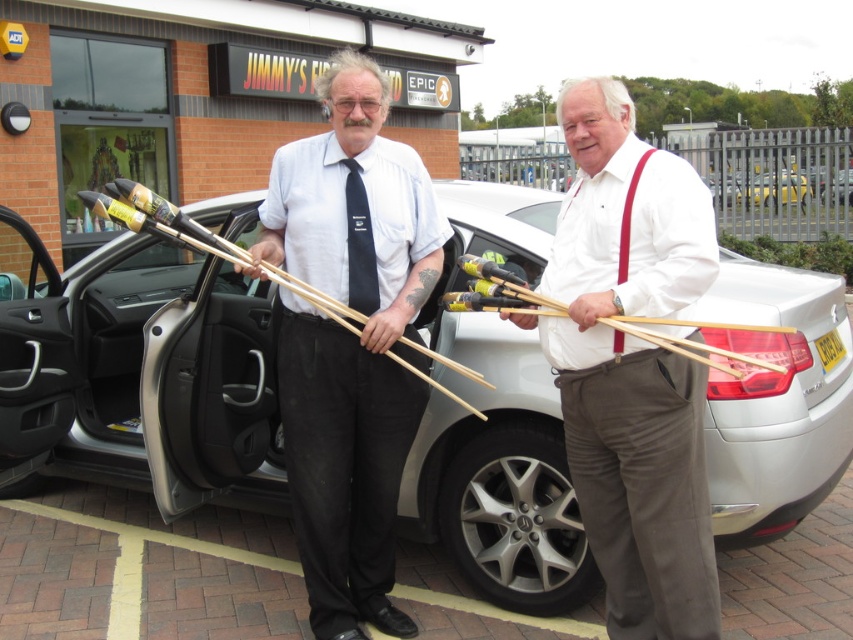
Question: Can you confirm if white matte shirt at center is smaller than white glossy sedan at center?

Choices:
 (A) no
 (B) yes

Answer: (A)

Question: Which object appears farthest from the camera in this image?

Choices:
 (A) white glossy sedan at center
 (B) white matte car at center
 (C) white matte shirt at center
 (D) wooden sticks at center

Answer: (A)

Question: Which object appears closest to the camera in this image?

Choices:
 (A) white matte shirt at center
 (B) wooden sticks at center
 (C) white glossy sedan at center

Answer: (A)

Question: In this image, where is wooden sticks at center located relative to white glossy sedan at center?

Choices:
 (A) above
 (B) below

Answer: (B)

Question: Is white matte car at center to the right of wooden sticks at center from the viewer's perspective?

Choices:
 (A) yes
 (B) no

Answer: (B)

Question: Which point is farther to the camera?

Choices:
 (A) white matte shirt at center
 (B) white matte car at center
 (C) white glossy sedan at center
 (D) wooden sticks at center

Answer: (C)